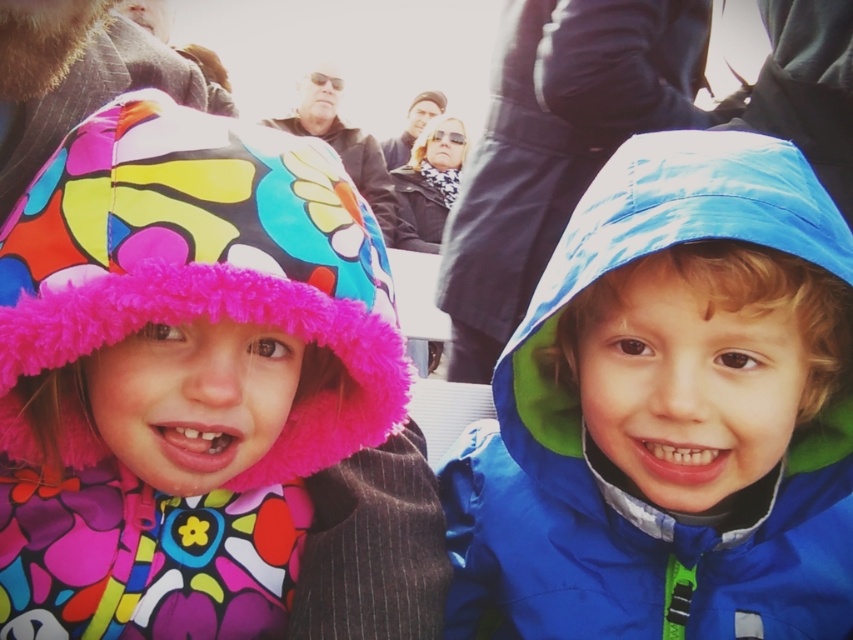
Question: Observing the image, what is the correct spatial positioning of blue waterproof jacket at center in reference to multicolored fleece hat at left?

Choices:
 (A) below
 (B) above

Answer: (A)

Question: Can you confirm if blue waterproof jacket at center is positioned below multicolored fleece hat at left?

Choices:
 (A) yes
 (B) no

Answer: (A)

Question: Which point is closer to the camera?

Choices:
 (A) (770, 528)
 (B) (119, 177)
 (C) (433, 102)

Answer: (B)

Question: Which of the following is the farthest from the observer?

Choices:
 (A) matte black hat at upper center
 (B) blue shiny raincoat at center

Answer: (A)

Question: Observing the image, what is the correct spatial positioning of blue waterproof jacket at center in reference to multicolored fleece hat at left?

Choices:
 (A) left
 (B) right

Answer: (B)

Question: Estimate the real-world distances between objects in this image. Which object is closer to the multicolored fleece hat at left?

Choices:
 (A) blue waterproof jacket at center
 (B) blue shiny raincoat at center
 (C) matte black hat at upper center

Answer: (A)